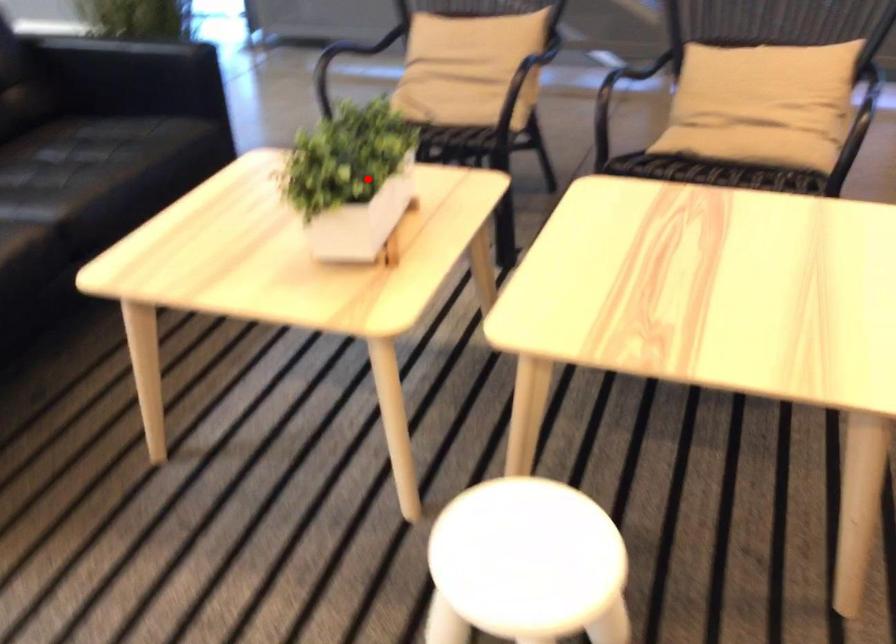
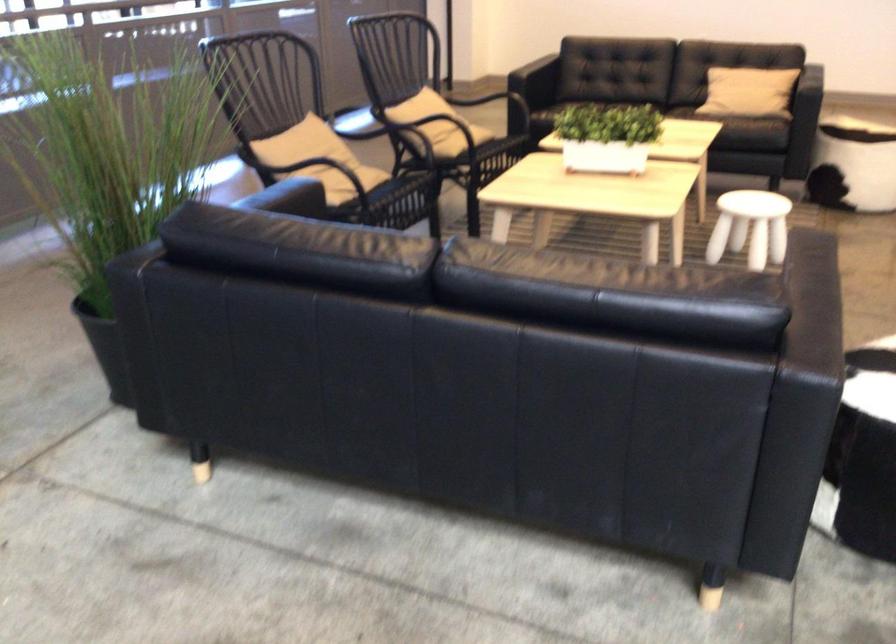
Question: I am providing you with two images of the same scene from different viewpoints. Image1 has a red point marked. In image2, the corresponding 3D location appears at what relative position? Reply with the corresponding letter.

Choices:
 (A) Closer
 (B) Farther

Answer: (B)